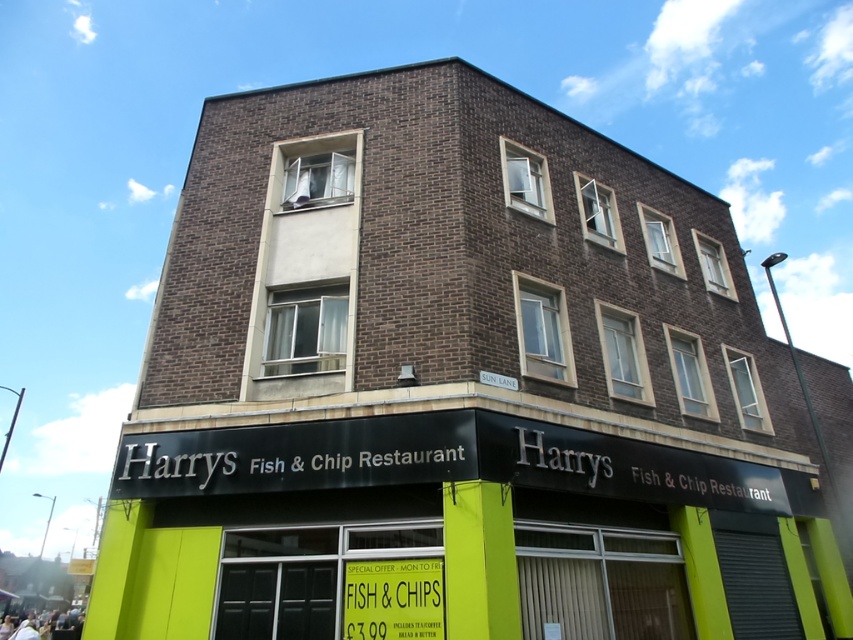
You are a customer standing in front of the building and want to read both the green matte signboard at lower center and the yellow paper sign at lower center. Which sign should you look to your left to see?

The yellow paper sign at lower center is to the left of the green matte signboard at lower center, so you should look to your left to see the yellow paper sign at lower center.

You are a customer standing in front of the Harrys Fish and Chip Restaurant. You see the green matte signboard at lower center and the yellow paper sign at lower center. Which one is bigger in size?

The green matte signboard at lower center is larger in size compared to the yellow paper sign at lower center.

You are standing in front of the building and notice a point marked at coordinates (456, 525). What object is located at this point?

The point at coordinates (456, 525) marks the green matte signboard at lower center.